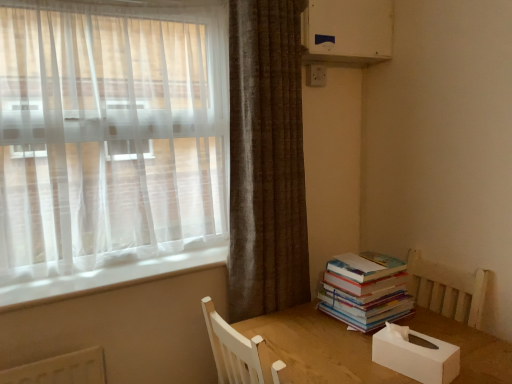
This screenshot has height=384, width=512. What do you see at coordinates (365, 290) in the screenshot? I see `hardcover books at right` at bounding box center [365, 290].

Where is `sheer white curtain at left, the 1th curtain in the left-to-right sequence`? The width and height of the screenshot is (512, 384). sheer white curtain at left, the 1th curtain in the left-to-right sequence is located at coordinates (110, 135).

Measure the distance between white plastic air conditioning unit at upper right and camera.

white plastic air conditioning unit at upper right and camera are 1.66 meters apart.

What is the approximate width of white plastic air conditioning unit at upper right?

The width of white plastic air conditioning unit at upper right is 6.84 inches.

This screenshot has width=512, height=384. What do you see at coordinates (106, 277) in the screenshot?
I see `white plastic window sill at lower left` at bounding box center [106, 277].

This screenshot has width=512, height=384. I want to click on hardcover books at right, so click(x=365, y=290).

In the image, is white plastic air conditioning unit at upper right positioned in front of or behind hardcover books at right?

white plastic air conditioning unit at upper right is positioned farther from the viewer than hardcover books at right.

Which of these two, white plastic air conditioning unit at upper right or hardcover books at right, is smaller?

hardcover books at right.

Is white plastic air conditioning unit at upper right wider than hardcover books at right?

No.

Could you measure the distance between white plastic electric outlet at upper center and white plastic window sill at lower left?

white plastic electric outlet at upper center is 3.69 feet away from white plastic window sill at lower left.

How many degrees apart are the facing directions of white plastic electric outlet at upper center and white plastic window sill at lower left?

The facing directions of white plastic electric outlet at upper center and white plastic window sill at lower left are 5.37 degrees apart.

Considering the sizes of objects white plastic electric outlet at upper center and white plastic window sill at lower left in the image provided, who is bigger, white plastic electric outlet at upper center or white plastic window sill at lower left?

Bigger between the two is white plastic window sill at lower left.

At what (x,y) coordinates should I click in order to perform the action: click on window sill on the left of white plastic electric outlet at upper center. Please return your answer as a coordinate pair (x, y). Looking at the image, I should click on (106, 277).

Considering the relative positions of sheer white curtain at left, the 1th curtain in the left-to-right sequence, and white plastic air conditioning unit at upper right in the image provided, is sheer white curtain at left, the 1th curtain in the left-to-right sequence, to the left of white plastic air conditioning unit at upper right from the viewer's perspective?

Yes, sheer white curtain at left, the 1th curtain in the left-to-right sequence, is to the left of white plastic air conditioning unit at upper right.

Is sheer white curtain at left, the 1th curtain in the left-to-right sequence, not within white plastic air conditioning unit at upper right?

sheer white curtain at left, the 1th curtain in the left-to-right sequence, is positioned outside white plastic air conditioning unit at upper right.

Between sheer white curtain at left, marked as the second curtain in a right-to-left arrangement, and white plastic air conditioning unit at upper right, which one is positioned in front?

Answer: Positioned in front is sheer white curtain at left, marked as the second curtain in a right-to-left arrangement.

Is white plastic electric outlet at upper center positioned with its back to white plastic air conditioning unit at upper right?

That's not correct — white plastic electric outlet at upper center is not looking away from white plastic air conditioning unit at upper right.

Visually, is white plastic electric outlet at upper center positioned to the left or to the right of white plastic air conditioning unit at upper right?

Clearly, white plastic electric outlet at upper center is on the left of white plastic air conditioning unit at upper right in the image.

Does white plastic electric outlet at upper center have a greater height compared to white plastic air conditioning unit at upper right?

Incorrect, the height of white plastic electric outlet at upper center is not larger of that of white plastic air conditioning unit at upper right.

From the image's perspective, which one is positioned lower, brown textured curtain at upper right, placed as the second curtain when sorted from left to right, or white matte tissue box at lower right?

white matte tissue box at lower right.

Find the location of `the 1st curtain positioned above the white matte tissue box at lower right (from the image's perspective)`. the 1st curtain positioned above the white matte tissue box at lower right (from the image's perspective) is located at coordinates (266, 160).

Measure the distance between brown textured curtain at upper right, placed as the second curtain when sorted from left to right, and white matte tissue box at lower right.

brown textured curtain at upper right, placed as the second curtain when sorted from left to right, and white matte tissue box at lower right are 27.36 inches apart from each other.

Considering the sizes of objects brown textured curtain at upper right, arranged as the 1th curtain when viewed from the right, and white matte tissue box at lower right in the image provided, who is bigger, brown textured curtain at upper right, arranged as the 1th curtain when viewed from the right, or white matte tissue box at lower right?

With larger size is brown textured curtain at upper right, arranged as the 1th curtain when viewed from the right.

Does white plastic electric outlet at upper center turn towards brown textured curtain at upper right, arranged as the 1th curtain when viewed from the right?

No, white plastic electric outlet at upper center does not turn towards brown textured curtain at upper right, arranged as the 1th curtain when viewed from the right.

In the scene shown: Measure the distance from white plastic electric outlet at upper center to brown textured curtain at upper right, arranged as the 1th curtain when viewed from the right.

white plastic electric outlet at upper center is 21.60 inches from brown textured curtain at upper right, arranged as the 1th curtain when viewed from the right.

Are white plastic electric outlet at upper center and brown textured curtain at upper right, placed as the second curtain when sorted from left to right, far apart?

No.

From a real-world perspective, which is physically below, white plastic electric outlet at upper center or brown textured curtain at upper right, arranged as the 1th curtain when viewed from the right?

brown textured curtain at upper right, arranged as the 1th curtain when viewed from the right, is physically lower.

Is white matte tissue box at lower right not close to white plastic air conditioning unit at upper right?

white matte tissue box at lower right is positioned a significant distance from white plastic air conditioning unit at upper right.

You are a GUI agent. You are given a task and a screenshot of the screen. Output one action in this format:
    pyautogui.click(x=<x>, y=<y>)
    Task: Click on the air conditioning that appears behind the white matte tissue box at lower right
    The height and width of the screenshot is (384, 512).
    Given the screenshot: What is the action you would take?
    pyautogui.click(x=347, y=31)

From the image's perspective, is white matte tissue box at lower right located above white plastic air conditioning unit at upper right?

No.

Between white matte tissue box at lower right and white plastic air conditioning unit at upper right, which one has smaller size?

white matte tissue box at lower right.

I want to click on book below the white plastic air conditioning unit at upper right (from the image's perspective), so click(365, 290).

Find the location of `electric outlet above the white plastic window sill at lower left (from the image's perspective)`. electric outlet above the white plastic window sill at lower left (from the image's perspective) is located at coordinates (315, 75).

Based on their spatial positions, is brown textured curtain at upper right, placed as the second curtain when sorted from left to right, or white plastic window sill at lower left further from sheer white curtain at left, marked as the second curtain in a right-to-left arrangement?

The object further to sheer white curtain at left, marked as the second curtain in a right-to-left arrangement, is white plastic window sill at lower left.

From the image, which object appears to be farther from white plastic window sill at lower left, brown textured curtain at upper right, placed as the second curtain when sorted from left to right, or sheer white curtain at left, marked as the second curtain in a right-to-left arrangement?

brown textured curtain at upper right, placed as the second curtain when sorted from left to right, is positioned further to the anchor white plastic window sill at lower left.

Based on their spatial positions, is white plastic window sill at lower left or brown textured curtain at upper right, arranged as the 1th curtain when viewed from the right, further from white plastic electric outlet at upper center?

white plastic window sill at lower left.

When comparing their distances from brown textured curtain at upper right, arranged as the 1th curtain when viewed from the right, does sheer white curtain at left, marked as the second curtain in a right-to-left arrangement, or hardcover books at right seem closer?

hardcover books at right lies closer to brown textured curtain at upper right, arranged as the 1th curtain when viewed from the right, than the other object.

Based on their spatial positions, is brown textured curtain at upper right, placed as the second curtain when sorted from left to right, or white plastic air conditioning unit at upper right closer to white plastic window sill at lower left?

Based on the image, brown textured curtain at upper right, placed as the second curtain when sorted from left to right, appears to be nearer to white plastic window sill at lower left.

Based on their spatial positions, is brown textured curtain at upper right, arranged as the 1th curtain when viewed from the right, or white matte tissue box at lower right further from hardcover books at right?

brown textured curtain at upper right, arranged as the 1th curtain when viewed from the right, is further to hardcover books at right.

Which object lies further to the anchor point sheer white curtain at left, marked as the second curtain in a right-to-left arrangement, brown textured curtain at upper right, arranged as the 1th curtain when viewed from the right, or white plastic electric outlet at upper center?

Among the two, white plastic electric outlet at upper center is located further to sheer white curtain at left, marked as the second curtain in a right-to-left arrangement.

Which object lies nearer to the anchor point white plastic electric outlet at upper center, sheer white curtain at left, the 1th curtain in the left-to-right sequence, or hardcover books at right?

sheer white curtain at left, the 1th curtain in the left-to-right sequence, lies closer to white plastic electric outlet at upper center than the other object.

Where is `window sill between white plastic air conditioning unit at upper right and white matte tissue box at lower right vertically`? The image size is (512, 384). window sill between white plastic air conditioning unit at upper right and white matte tissue box at lower right vertically is located at coordinates (106, 277).

The height and width of the screenshot is (384, 512). I want to click on window sill between sheer white curtain at left, the 1th curtain in the left-to-right sequence, and white plastic electric outlet at upper center from left to right, so click(106, 277).

Locate an element on the screen. Image resolution: width=512 pixels, height=384 pixels. electric outlet located between sheer white curtain at left, the 1th curtain in the left-to-right sequence, and hardcover books at right in the left-right direction is located at coordinates (315, 75).

This screenshot has width=512, height=384. I want to click on book between white plastic window sill at lower left and white matte tissue box at lower right, so click(365, 290).